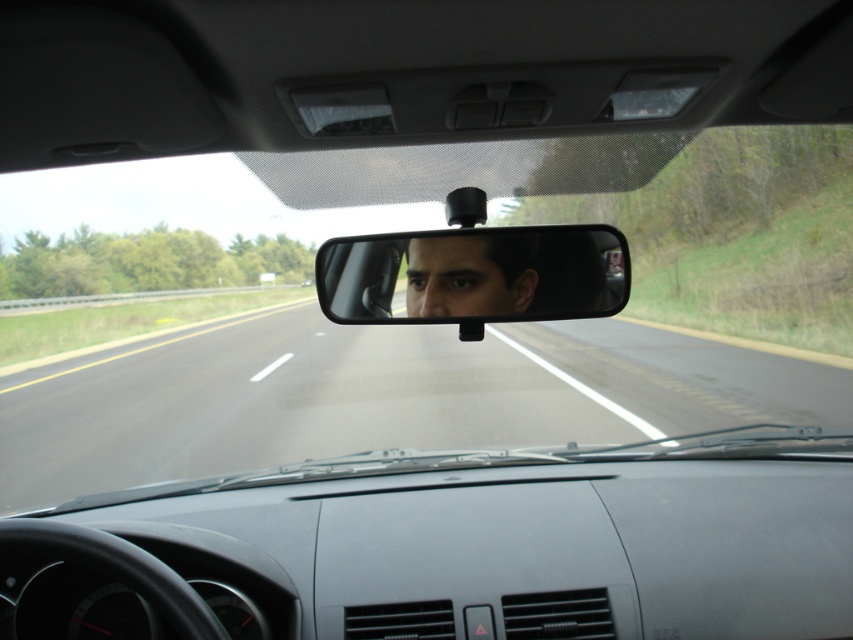
Between clear plastic mirror at center and matte black face at center, which one has less height?

matte black face at center is shorter.

Who is taller, clear plastic mirror at center or matte black face at center?

clear plastic mirror at center is taller.

Looking at this image, who is more forward, (x=468, y=280) or (x=491, y=272)?

Point (x=491, y=272)

I want to click on clear plastic mirror at center, so click(474, 275).